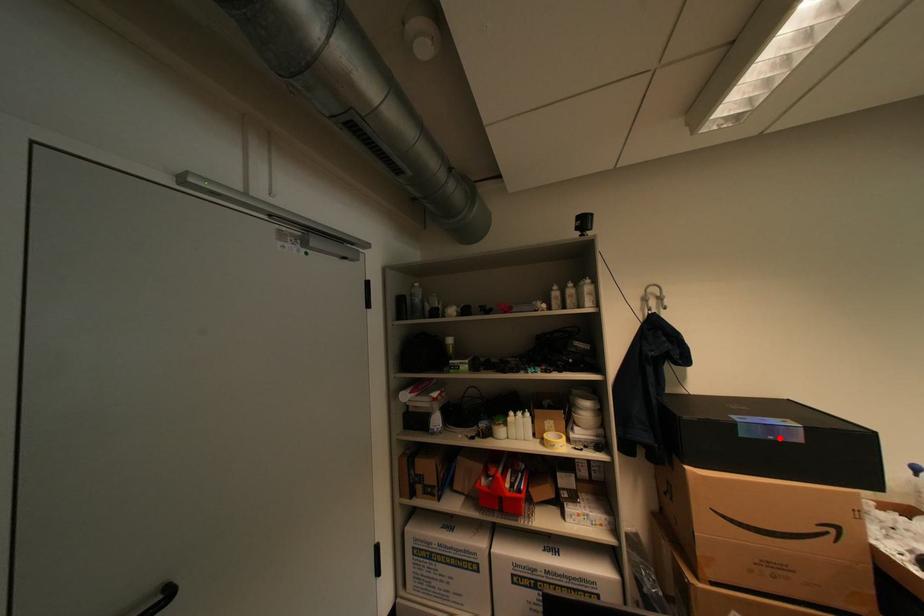
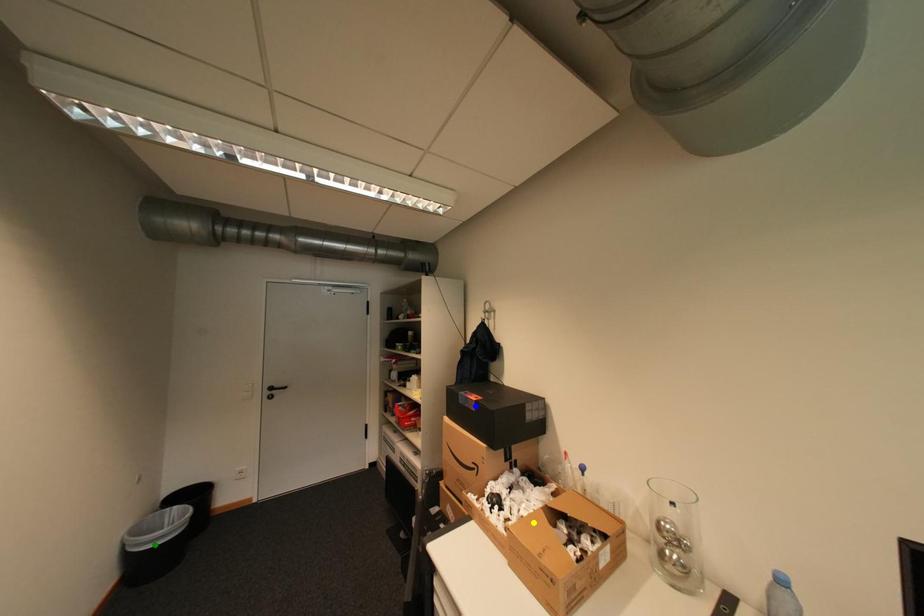
Question: I am providing you with two images of the same scene from different viewpoints. A red point is marked on the first image. You are given multiple points on the second image. Which mark in image 2 goes with the point in image 1?

Choices:
 (A) yellow point
 (B) blue point
 (C) green point

Answer: (B)